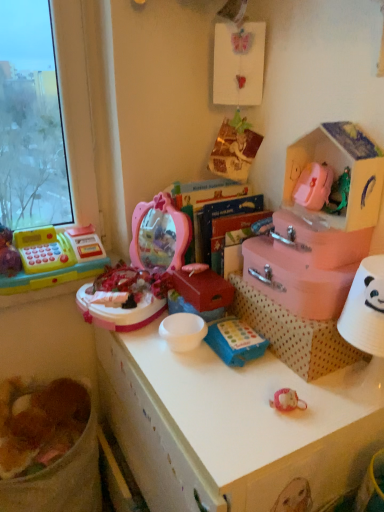
Question: Can you confirm if brown crumbly food at lower left is taller than pink cardboard storage box at upper right?

Choices:
 (A) yes
 (B) no

Answer: (B)

Question: Is brown crumbly food at lower left shorter than pink cardboard storage box at upper right?

Choices:
 (A) no
 (B) yes

Answer: (B)

Question: Is the depth of brown crumbly food at lower left greater than that of pink cardboard storage box at upper right?

Choices:
 (A) yes
 (B) no

Answer: (A)

Question: Is brown crumbly food at lower left smaller than pink cardboard storage box at upper right?

Choices:
 (A) yes
 (B) no

Answer: (A)

Question: From a real-world perspective, does brown crumbly food at lower left sit lower than pink cardboard storage box at upper right?

Choices:
 (A) no
 (B) yes

Answer: (B)

Question: From the image's perspective, is brown crumbly food at lower left located above pink cardboard storage box at upper right?

Choices:
 (A) no
 (B) yes

Answer: (A)

Question: Considering the relative sizes of pink cardboard storage box at upper right and brown crumbly food at lower left in the image provided, is pink cardboard storage box at upper right taller than brown crumbly food at lower left?

Choices:
 (A) no
 (B) yes

Answer: (B)

Question: From the image's perspective, does pink cardboard storage box at upper right appear higher than brown crumbly food at lower left?

Choices:
 (A) no
 (B) yes

Answer: (B)

Question: Can you confirm if pink cardboard storage box at upper right is thinner than brown crumbly food at lower left?

Choices:
 (A) yes
 (B) no

Answer: (A)

Question: Is pink cardboard storage box at upper right wider than brown crumbly food at lower left?

Choices:
 (A) yes
 (B) no

Answer: (B)

Question: Is brown crumbly food at lower left inside pink cardboard storage box at upper right?

Choices:
 (A) no
 (B) yes

Answer: (A)

Question: Is pink cardboard storage box at upper right looking in the opposite direction of brown crumbly food at lower left?

Choices:
 (A) no
 (B) yes

Answer: (A)

Question: Is the position of blue fabric toy at center, which appears as the first toy when ordered from the bottom, less distant than that of pink cardboard storage box at upper right?

Choices:
 (A) no
 (B) yes

Answer: (A)